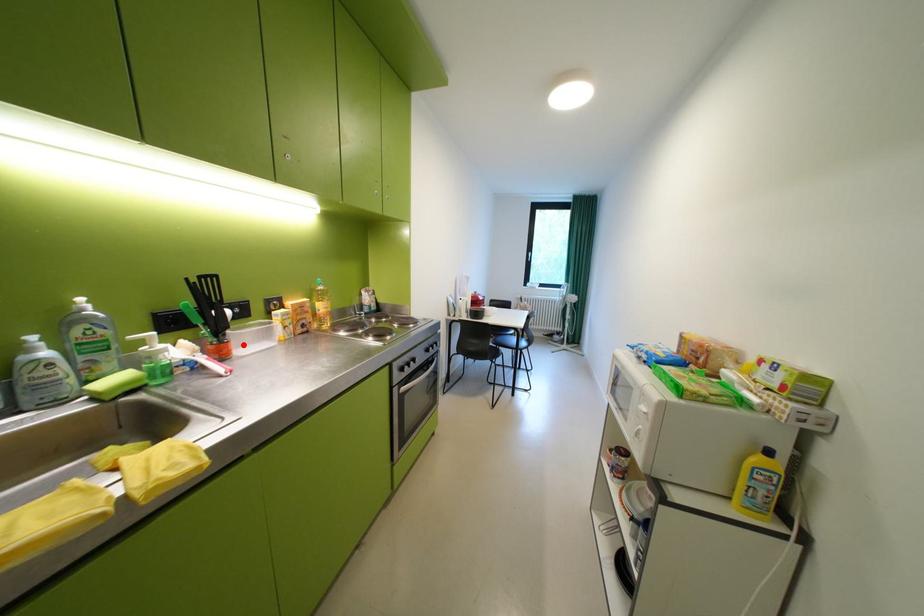
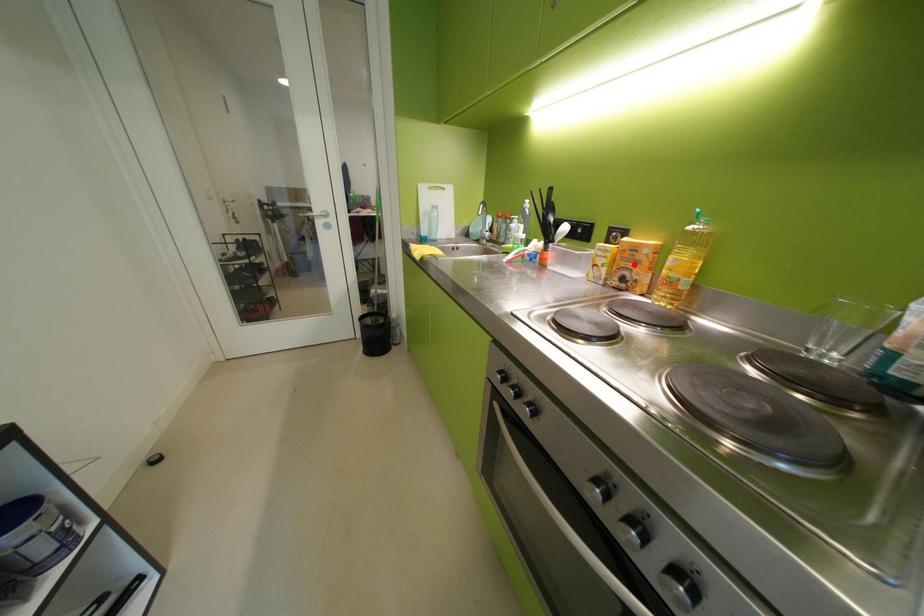
I am providing you with two images of the same scene from different viewpoints. A red point is marked on the first image and another point is marked on the second image. Is the marked point in image1 the same physical position as the marked point in image2?

No